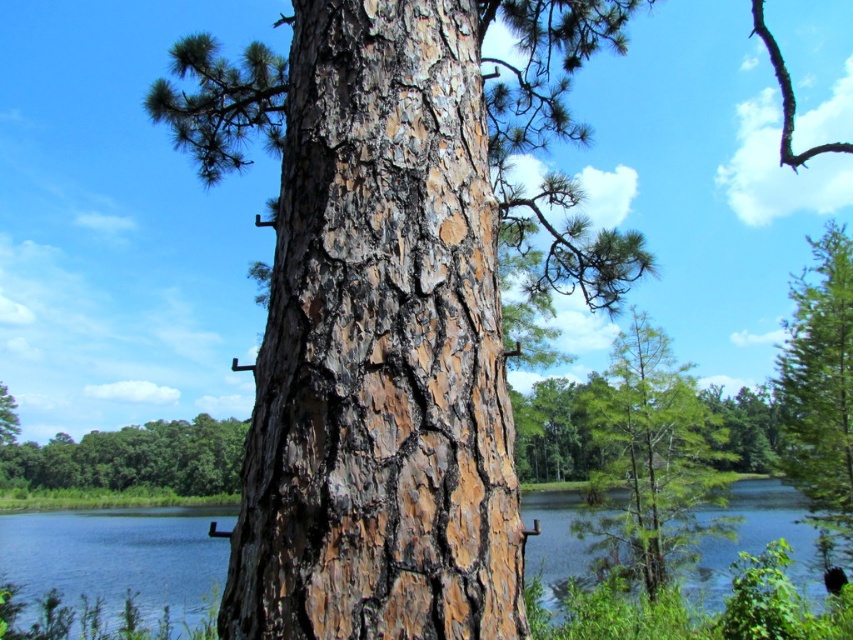
Question: Does blue water at center appear under green matte tree at right?

Choices:
 (A) no
 (B) yes

Answer: (B)

Question: Which of these objects is positioned farthest from the brown rough bark at center?

Choices:
 (A) blue water at center
 (B) green matte tree at right
 (C) green matte tree at center

Answer: (B)

Question: Is brown rough bark at center below green matte tree at center?

Choices:
 (A) no
 (B) yes

Answer: (A)

Question: Among these points, which one is farthest from the camera?

Choices:
 (A) (401, 572)
 (B) (132, 557)
 (C) (635, 433)
 (D) (842, 454)

Answer: (B)

Question: In this image, where is green matte tree at right located relative to green rough bark tree at lower left?

Choices:
 (A) above
 (B) below

Answer: (A)

Question: Based on their relative distances, which object is nearer to the green rough bark tree at lower left?

Choices:
 (A) blue water at center
 (B) green matte tree at center

Answer: (A)